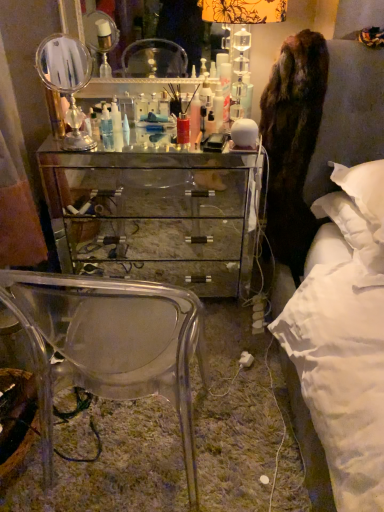
Where is `vacant space to the left of white glossy bottle at center, which is the 1th toiletry from right to left`? vacant space to the left of white glossy bottle at center, which is the 1th toiletry from right to left is located at coordinates (180, 124).